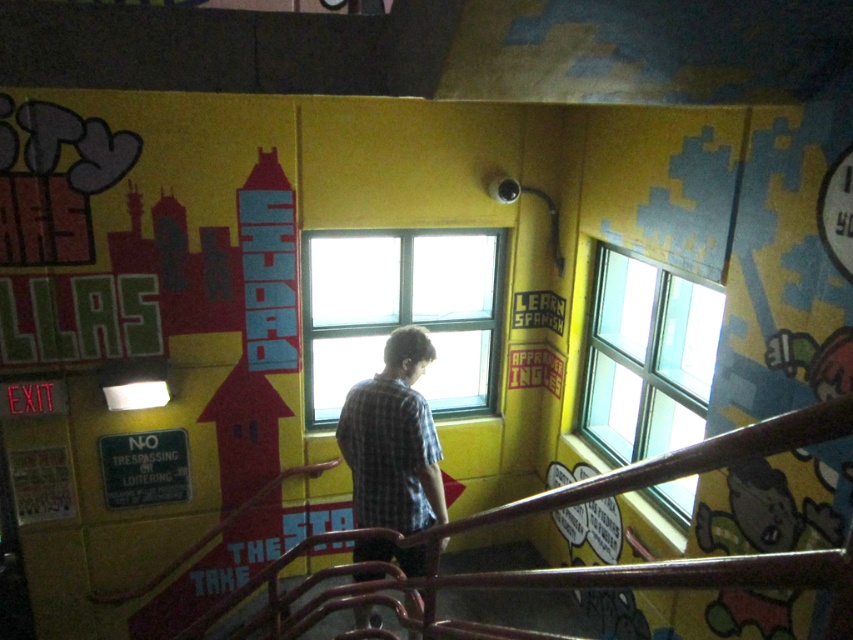
You are a painter who needs to clean all the windows in the room. The clear glass window at center and the clear glass window at upper center need attention. Which window will require more time to clean due to its size?

The clear glass window at center will require more time to clean because it is larger in size than the clear glass window at upper center.

Based on the photo, you are standing in a room with a rusty metal railing at center and a clear glass window at center. Which object is positioned to the right side of the other?

The rusty metal railing at center is to the right of the clear glass window at center.

You are standing in the room described. If you face the window and look directly ahead, will the rusty metal railing at center be in your line of sight?

The rusty metal railing at center is located at point (566, 566) in 2D space. Since facing the window would mean looking towards the lower right area of the scene, the railing is centrally positioned and likely within your line of sight.